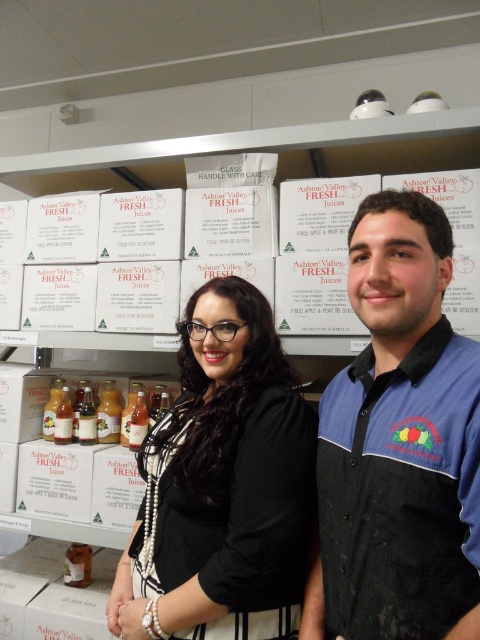
Question: Which point appears closest to the camera in this image?

Choices:
 (A) (124, 596)
 (B) (408, 618)

Answer: (B)

Question: Is the position of blue fabric shirt at center less distant than that of black matte blouse at center?

Choices:
 (A) yes
 (B) no

Answer: (A)

Question: Among these objects, which one is farthest from the camera?

Choices:
 (A) blue fabric shirt at center
 (B) black matte blouse at center

Answer: (B)

Question: Which object appears farthest from the camera in this image?

Choices:
 (A) blue fabric shirt at center
 (B) black matte blouse at center

Answer: (B)

Question: Is blue fabric shirt at center wider than black matte blouse at center?

Choices:
 (A) yes
 (B) no

Answer: (B)

Question: Is blue fabric shirt at center positioned before black matte blouse at center?

Choices:
 (A) yes
 (B) no

Answer: (A)